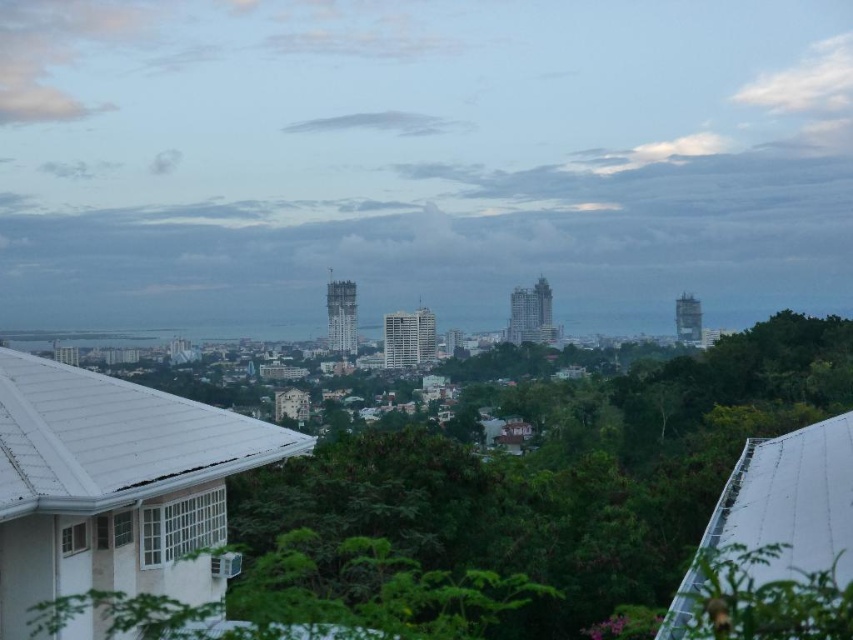
This screenshot has height=640, width=853. What do you see at coordinates (421, 161) in the screenshot?
I see `smooth concrete skyline at center` at bounding box center [421, 161].

The width and height of the screenshot is (853, 640). Identify the location of smooth concrete skyline at center. (421, 161).

Measure the distance between point (431, 131) and camera.

Point (431, 131) is 524.30 meters away from camera.

Where is `smooth concrete skyline at center`? Image resolution: width=853 pixels, height=640 pixels. smooth concrete skyline at center is located at coordinates (421, 161).